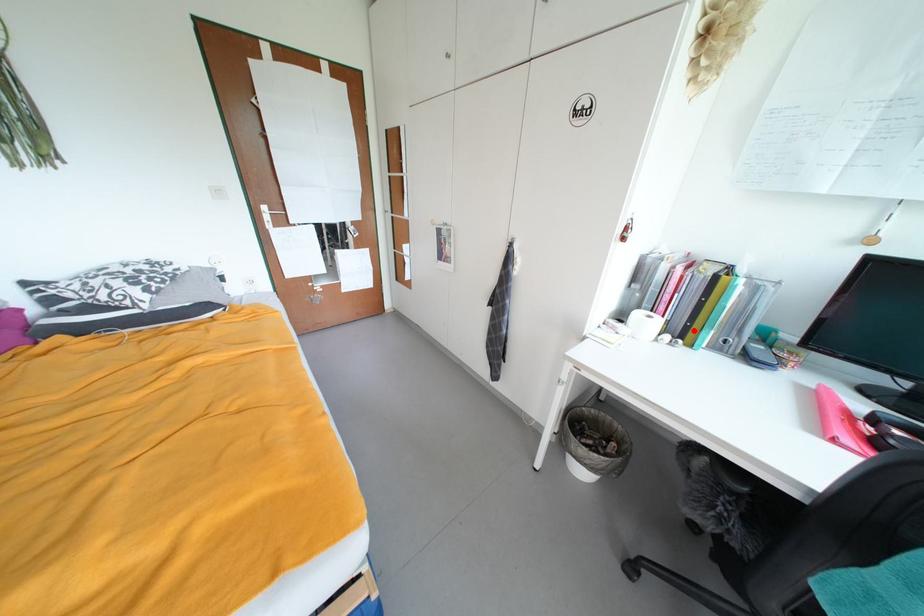
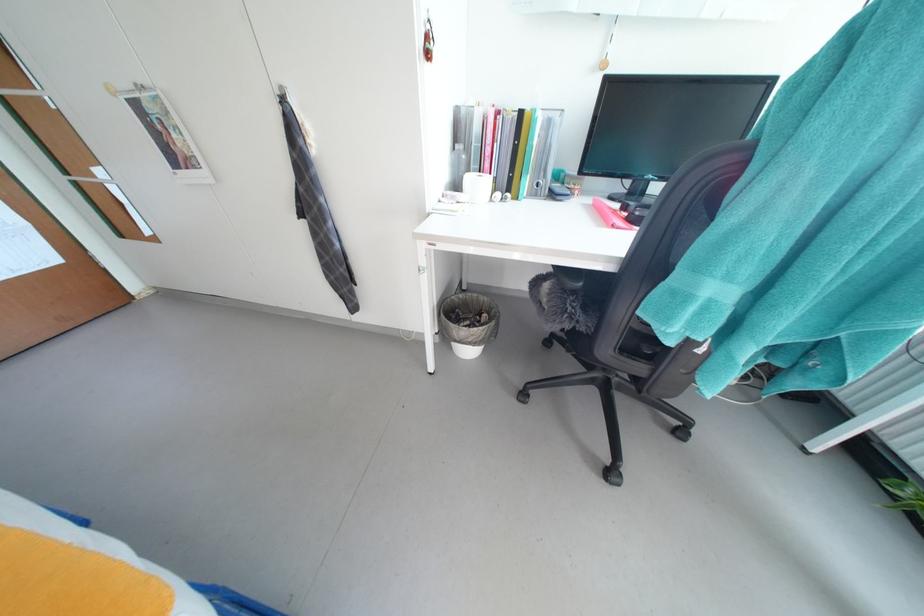
Question: I am providing you with two images of the same scene from different viewpoints. A red point is marked on the first image. At the location where the point appears in image 1, is it still visible in image 2?

Choices:
 (A) Yes
 (B) No

Answer: (A)